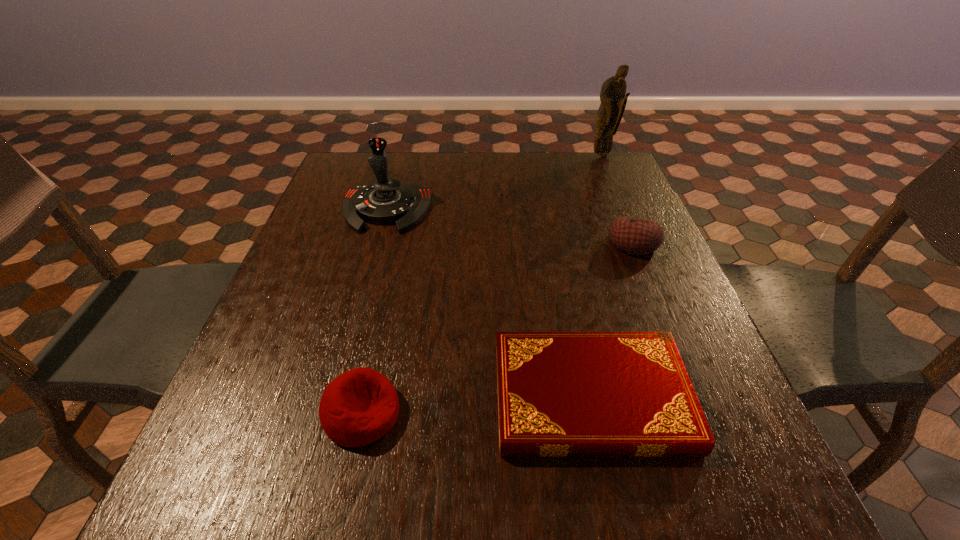
The width and height of the screenshot is (960, 540). Find the location of `empty location between the left beanbag and the farthest object`. empty location between the left beanbag and the farthest object is located at coordinates (482, 285).

Locate an element on the screen. The height and width of the screenshot is (540, 960). vacant region between the shortest object and the figurine is located at coordinates (596, 276).

I want to click on unoccupied area between the left beanbag and the shortest object, so click(476, 405).

Find the location of `free spot between the shortest object and the joystick`. free spot between the shortest object and the joystick is located at coordinates (489, 304).

This screenshot has width=960, height=540. In order to click on empty space that is in between the second tallest object and the farthest object in this screenshot , I will do `click(493, 183)`.

Locate an element on the screen. vacant point located between the shortest object and the joystick is located at coordinates (489, 304).

Identify the location of object that is the third closest to the tallest object. (560, 394).

Identify which object is located as the second nearest to the joystick. Please provide its 2D coordinates. Your answer should be formatted as a tuple, i.e. [(x, y)], where the tuple contains the x and y coordinates of a point satisfying the conditions above.

[(360, 406)]

You are a GUI agent. You are given a task and a screenshot of the screen. Output one action in this format:
    pyautogui.click(x=<x>, y=<y>)
    Task: Click on the free spot that satisfies the following two spatial constraints: 1. on the front-facing side of the figurine; 2. on the cover of the hardback book
    
    Given the screenshot: What is the action you would take?
    pyautogui.click(x=703, y=397)

You are a GUI agent. You are given a task and a screenshot of the screen. Output one action in this format:
    pyautogui.click(x=<x>, y=<y>)
    Task: Click on the blank area in the image that satisfies the following two spatial constraints: 1. on the front-facing side of the farthest object; 2. on the cover of the shortest object
    This screenshot has width=960, height=540.
    Given the screenshot: What is the action you would take?
    pyautogui.click(x=703, y=397)